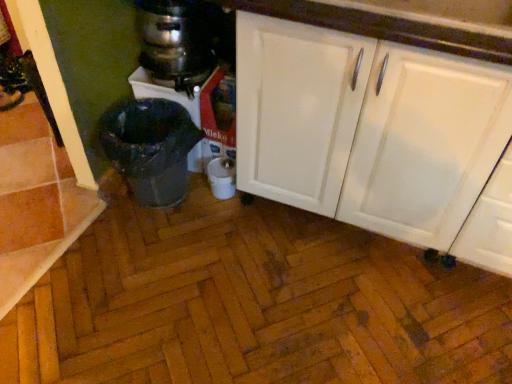
Question: Considering their positions, is metallic silver blender at center located in front of or behind metallic stainless steel coffee maker at upper left?

Choices:
 (A) front
 (B) behind

Answer: (B)

Question: Considering the positions of metallic silver blender at center and metallic stainless steel coffee maker at upper left in the image, is metallic silver blender at center taller or shorter than metallic stainless steel coffee maker at upper left?

Choices:
 (A) tall
 (B) short

Answer: (A)

Question: Which object is positioned closest to the white glossy cabinet at upper right?

Choices:
 (A) metallic stainless steel coffee maker at upper left
 (B) metallic silver blender at center
 (C) shiny metallic trash can at lower left
 (D) white matte cabinet at center

Answer: (D)

Question: Based on their relative distances, which object is nearer to the white glossy cabinet at upper right?

Choices:
 (A) shiny metallic trash can at lower left
 (B) white matte cabinet at center
 (C) metallic silver blender at center
 (D) metallic stainless steel coffee maker at upper left

Answer: (B)